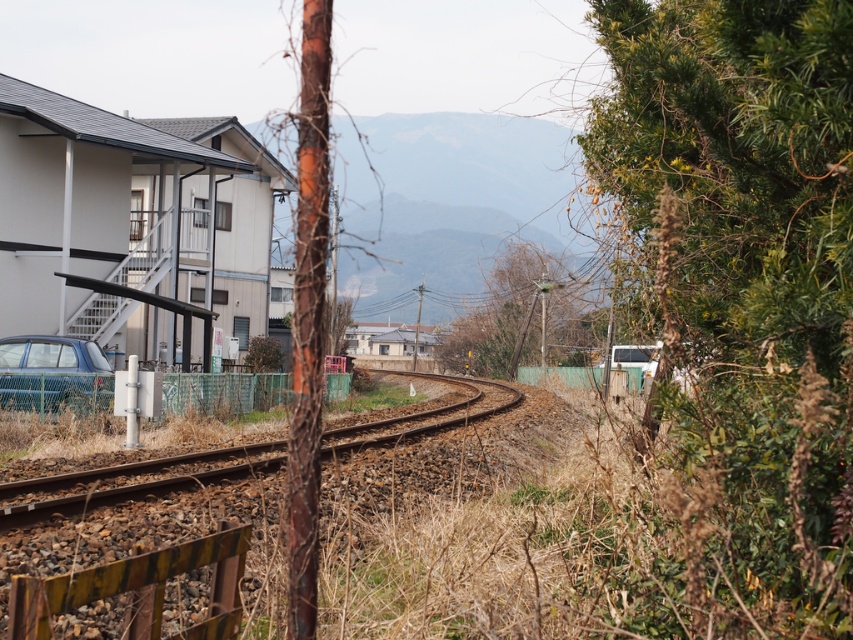
Question: Is bare branches at center to the right of matte blue hatchback at lower left from the viewer's perspective?

Choices:
 (A) no
 (B) yes

Answer: (B)

Question: Does bare branches at center have a smaller size compared to brown gravel track at center?

Choices:
 (A) yes
 (B) no

Answer: (B)

Question: Estimate the real-world distances between objects in this image. Which object is farther from the matte blue hatchback at lower left?

Choices:
 (A) bare branches at center
 (B) brown gravel track at center

Answer: (A)

Question: Which point is closer to the camera?

Choices:
 (A) (527, 259)
 (B) (173, 486)
 (C) (64, 400)

Answer: (B)

Question: Can you confirm if bare branches at center is positioned below matte blue hatchback at lower left?

Choices:
 (A) no
 (B) yes

Answer: (A)

Question: Which object is the closest to the brown gravel track at center?

Choices:
 (A) matte blue hatchback at lower left
 (B) bare branches at center

Answer: (A)